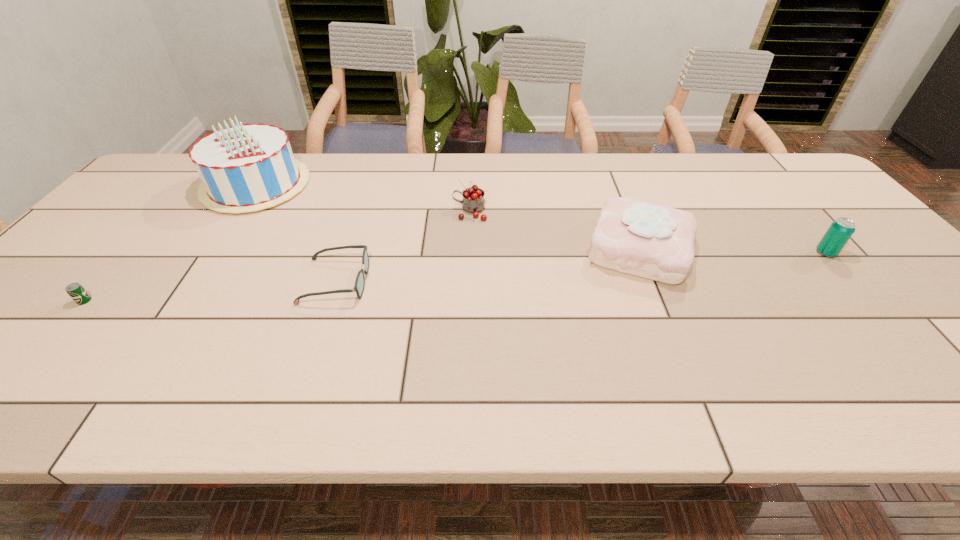
You are a GUI agent. You are given a task and a screenshot of the screen. Output one action in this format:
    pyautogui.click(x=<x>, y=<y>)
    Task: Click on the free point at the near edge
    
    Given the screenshot: What is the action you would take?
    pyautogui.click(x=241, y=380)

Where is `vacant space at the right edge of the desktop`? vacant space at the right edge of the desktop is located at coordinates (864, 239).

The image size is (960, 540). Find the location of `empty space between the spectacles and the third object from right to left`. empty space between the spectacles and the third object from right to left is located at coordinates (403, 246).

Locate an element on the screen. free space between the cherry and the cake is located at coordinates (555, 230).

What are the coordinates of `empty location between the left beer can and the spectacles` in the screenshot? It's located at (210, 291).

Find the location of a particular element. This screenshot has height=540, width=960. unoccupied area between the third object from left to right and the cherry is located at coordinates (403, 246).

Identify the location of vacant space that is in between the nearer beer can and the spectacles. Image resolution: width=960 pixels, height=540 pixels. (210, 291).

Where is `free point between the third object from left to right and the shorter beer can`? The image size is (960, 540). free point between the third object from left to right and the shorter beer can is located at coordinates (210, 291).

At what (x,y) coordinates should I click in order to perform the action: click on free space between the tallest object and the fourth object from left to right. Please return your answer as a coordinate pair (x, y). The image size is (960, 540). Looking at the image, I should click on coord(363,198).

What are the coordinates of `blank region between the cherry and the spectacles` in the screenshot? It's located at (403, 246).